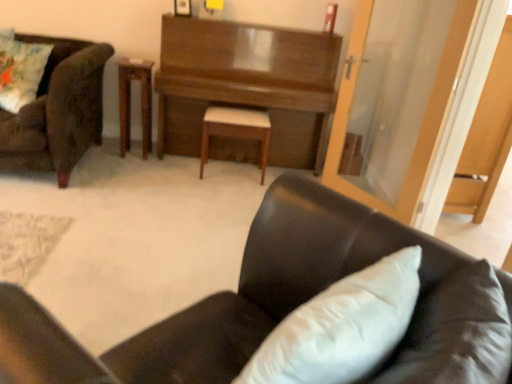
Question: Is wooden table at center in front of black leather chair at lower right, the second chair in the back-to-front sequence?

Choices:
 (A) yes
 (B) no

Answer: (B)

Question: From a real-world perspective, is wooden table at center below black leather chair at lower right, the first chair in the bottom-to-top sequence?

Choices:
 (A) no
 (B) yes

Answer: (B)

Question: Is wooden table at center bigger than black leather chair at lower right, the 1th chair positioned from the right?

Choices:
 (A) no
 (B) yes

Answer: (A)

Question: Could you tell me if wooden table at center is turned towards black leather chair at lower right, positioned as the 1th chair in front-to-back order?

Choices:
 (A) yes
 (B) no

Answer: (B)

Question: Can you confirm if wooden table at center is positioned to the right of black leather chair at lower right, the second chair viewed from the top?

Choices:
 (A) yes
 (B) no

Answer: (B)

Question: Relative to transparent glass door at right, is white leather stool at center in front or behind?

Choices:
 (A) behind
 (B) front

Answer: (A)

Question: From their relative heights in the image, would you say white leather stool at center is taller or shorter than transparent glass door at right?

Choices:
 (A) short
 (B) tall

Answer: (A)

Question: Is point (262, 180) positioned closer to the camera than point (453, 187)?

Choices:
 (A) farther
 (B) closer

Answer: (A)

Question: Is white leather stool at center wider or thinner than transparent glass door at right?

Choices:
 (A) thin
 (B) wide

Answer: (A)

Question: Considering their positions, is shiny brown piano at center located in front of or behind white leather stool at center?

Choices:
 (A) front
 (B) behind

Answer: (A)

Question: Is shiny brown piano at center taller or shorter than white leather stool at center?

Choices:
 (A) tall
 (B) short

Answer: (A)

Question: In terms of size, does shiny brown piano at center appear bigger or smaller than white leather stool at center?

Choices:
 (A) small
 (B) big

Answer: (B)

Question: Is point (200, 43) closer or farther from the camera than point (250, 112)?

Choices:
 (A) closer
 (B) farther

Answer: (A)

Question: Does point (65, 155) appear closer or farther from the camera than point (206, 327)?

Choices:
 (A) farther
 (B) closer

Answer: (A)

Question: Considering the relative positions of velvet brown armchair at left, the first chair positioned from the left, and black leather chair at lower right, the second chair in the back-to-front sequence, in the image provided, is velvet brown armchair at left, the first chair positioned from the left, to the left or to the right of black leather chair at lower right, the second chair in the back-to-front sequence,?

Choices:
 (A) left
 (B) right

Answer: (A)